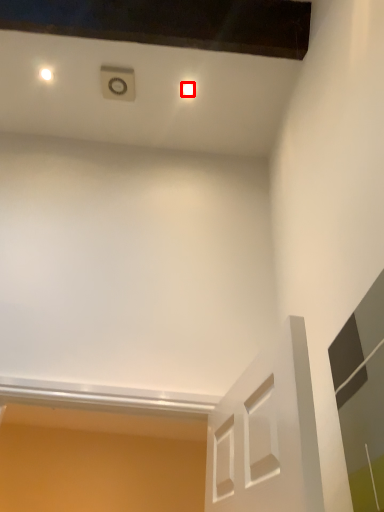
Question: Where is dot (annotated by the red box) located in relation to glass door in the image?

Choices:
 (A) right
 (B) left

Answer: (B)